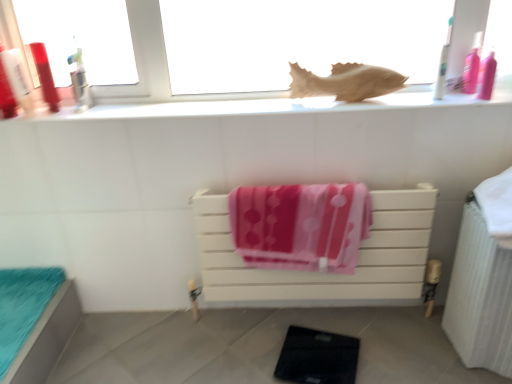
Question: Can you confirm if white plastic toothbrush at upper right, marked as the third toiletry in a left-to-right arrangement, is positioned to the right of white wooden towel rack at center, the second furniture from the left?

Choices:
 (A) yes
 (B) no

Answer: (A)

Question: Is white plastic toothbrush at upper right, marked as the third toiletry in a left-to-right arrangement, located outside white wooden towel rack at center, the first furniture positioned from the right?

Choices:
 (A) no
 (B) yes

Answer: (B)

Question: Could white wooden towel rack at center, the first furniture positioned from the right, be considered to be inside white plastic toothbrush at upper right, the second toiletry viewed from the right?

Choices:
 (A) yes
 (B) no

Answer: (B)

Question: Does white plastic toothbrush at upper right, marked as the third toiletry in a left-to-right arrangement, have a larger size compared to white wooden towel rack at center, the first furniture positioned from the right?

Choices:
 (A) yes
 (B) no

Answer: (B)

Question: Can you confirm if white plastic toothbrush at upper right, marked as the third toiletry in a left-to-right arrangement, is taller than white wooden towel rack at center, the first furniture positioned from the right?

Choices:
 (A) no
 (B) yes

Answer: (A)

Question: Does white plastic toothbrush at upper right, the second toiletry viewed from the right, come in front of white wooden towel rack at center, the first furniture positioned from the right?

Choices:
 (A) no
 (B) yes

Answer: (B)

Question: Is wooden fish at upper center far away from white plastic toothbrush at upper right, the second toiletry viewed from the right?

Choices:
 (A) no
 (B) yes

Answer: (A)

Question: Is wooden fish at upper center in contact with white plastic toothbrush at upper right, the second toiletry viewed from the right?

Choices:
 (A) no
 (B) yes

Answer: (A)

Question: Can you confirm if wooden fish at upper center is shorter than white plastic toothbrush at upper right, the second toiletry viewed from the right?

Choices:
 (A) yes
 (B) no

Answer: (A)

Question: Is wooden fish at upper center to the left of white plastic toothbrush at upper right, marked as the third toiletry in a left-to-right arrangement, from the viewer's perspective?

Choices:
 (A) no
 (B) yes

Answer: (B)

Question: Is wooden fish at upper center bigger than white plastic toothbrush at upper right, marked as the third toiletry in a left-to-right arrangement?

Choices:
 (A) no
 (B) yes

Answer: (B)

Question: Is wooden fish at upper center facing towards white plastic toothbrush at upper right, the second toiletry viewed from the right?

Choices:
 (A) no
 (B) yes

Answer: (A)

Question: From the image's perspective, would you say white textured radiator at right is shown under matte plastic toothbrush at upper left, arranged as the third toiletry when viewed from the right?

Choices:
 (A) no
 (B) yes

Answer: (B)